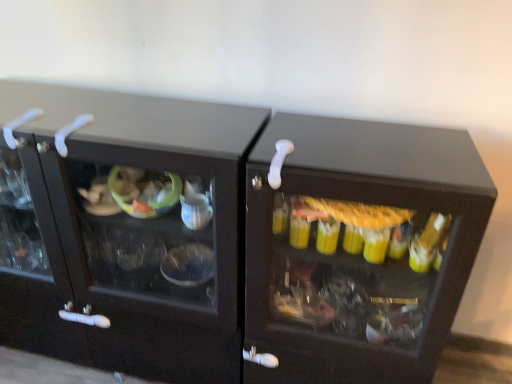
What is the approximate height of white plastic door handle at upper left, the 2th door handle positioned from the right?

9.15 centimeters.

Describe the element at coordinates (279, 162) in the screenshot. This screenshot has height=384, width=512. I see `white plastic door handle at center, the 3th door handle when ordered from left to right` at that location.

At what (x,y) coordinates should I click in order to perform the action: click on white plastic door handle at center, arranged as the first door handle when viewed from the right. Please return your answer as a coordinate pair (x, y). Looking at the image, I should click on (279, 162).

Find the location of a particular element. Image resolution: width=512 pixels, height=384 pixels. white plastic door handle at upper left, placed as the second door handle when sorted from left to right is located at coordinates (70, 132).

Could you measure the distance between white plastic door handle at center, the 3th door handle when ordered from left to right, and white plastic door handle at upper left, placed as the second door handle when sorted from left to right?

They are 59.71 centimeters apart.

Could white plastic door handle at upper left, the 2th door handle positioned from the right, be considered to be inside white plastic door handle at center, the 3th door handle when ordered from left to right?

No.

Considering the relative positions of white plastic door handle at center, the 3th door handle when ordered from left to right, and white plastic door handle at upper left, the 2th door handle positioned from the right, in the image provided, is white plastic door handle at center, the 3th door handle when ordered from left to right, in front of white plastic door handle at upper left, the 2th door handle positioned from the right,?

Yes, white plastic door handle at center, the 3th door handle when ordered from left to right, is closer to the viewer.

From the image's perspective, is white plastic door handle at center, arranged as the first door handle when viewed from the right, over white plastic door handle at upper left, the 2th door handle positioned from the right?

No, from the image's perspective, white plastic door handle at center, arranged as the first door handle when viewed from the right, is not over white plastic door handle at upper left, the 2th door handle positioned from the right.

Which object is thinner, white plastic door handle at upper left, placed as the 3th door handle when sorted from right to left, or white plastic door handle at upper left, the 2th door handle positioned from the right?

Thinner between the two is white plastic door handle at upper left, the 2th door handle positioned from the right.

Which is more to the left, white plastic door handle at upper left, acting as the 1th door handle starting from the left, or white plastic door handle at upper left, placed as the second door handle when sorted from left to right?

white plastic door handle at upper left, acting as the 1th door handle starting from the left.

Considering the points (21, 141) and (61, 148), which point is in front, point (21, 141) or point (61, 148)?

The point (61, 148) is closer to the camera.

Are white plastic door handle at upper left, placed as the 3th door handle when sorted from right to left, and white plastic door handle at upper left, the 2th door handle positioned from the right, making contact?

No, white plastic door handle at upper left, placed as the 3th door handle when sorted from right to left, is not with white plastic door handle at upper left, the 2th door handle positioned from the right.

Is white plastic door handle at upper left, acting as the 1th door handle starting from the left, positioned before white plastic door handle at center, the 3th door handle when ordered from left to right?

No, white plastic door handle at upper left, acting as the 1th door handle starting from the left, is further to the viewer.

From a real-world perspective, is white plastic door handle at upper left, placed as the 3th door handle when sorted from right to left, on white plastic door handle at center, arranged as the first door handle when viewed from the right?

Yes, from a real-world perspective, white plastic door handle at upper left, placed as the 3th door handle when sorted from right to left, is on top of white plastic door handle at center, arranged as the first door handle when viewed from the right.

Can you confirm if white plastic door handle at upper left, placed as the 3th door handle when sorted from right to left, is wider than white plastic door handle at center, arranged as the first door handle when viewed from the right?

In fact, white plastic door handle at upper left, placed as the 3th door handle when sorted from right to left, might be narrower than white plastic door handle at center, arranged as the first door handle when viewed from the right.

Is white plastic door handle at upper left, placed as the 3th door handle when sorted from right to left, positioned beyond the bounds of white plastic door handle at center, the 3th door handle when ordered from left to right?

Yes.

Who is shorter, white plastic door handle at center, the 3th door handle when ordered from left to right, or white plastic door handle at upper left, acting as the 1th door handle starting from the left?

white plastic door handle at center, the 3th door handle when ordered from left to right.

Consider the image. Which object is positioned more to the right, white plastic door handle at center, the 3th door handle when ordered from left to right, or white plastic door handle at upper left, acting as the 1th door handle starting from the left?

Positioned to the right is white plastic door handle at center, the 3th door handle when ordered from left to right.

Is white plastic door handle at center, arranged as the first door handle when viewed from the right, positioned with its back to white plastic door handle at upper left, acting as the 1th door handle starting from the left?

white plastic door handle at center, arranged as the first door handle when viewed from the right, is not turned away from white plastic door handle at upper left, acting as the 1th door handle starting from the left.

Which is farther, (286, 149) or (15, 145)?

The point (15, 145) is farther from the camera.

From a real-world perspective, does white plastic door handle at upper left, the 2th door handle positioned from the right, sit lower than white plastic door handle at center, the 3th door handle when ordered from left to right?

No.

Are white plastic door handle at upper left, placed as the second door handle when sorted from left to right, and white plastic door handle at center, the 3th door handle when ordered from left to right, far apart?

No, white plastic door handle at upper left, placed as the second door handle when sorted from left to right, is not far from white plastic door handle at center, the 3th door handle when ordered from left to right.

Does point (92, 119) come in front of point (293, 149)?

No, it is behind (293, 149).

Is white plastic door handle at center, the 3th door handle when ordered from left to right, located within white plastic door handle at upper left, placed as the second door handle when sorted from left to right?

No, white plastic door handle at center, the 3th door handle when ordered from left to right, is located outside of white plastic door handle at upper left, placed as the second door handle when sorted from left to right.

Could you tell me if white plastic door handle at upper left, placed as the second door handle when sorted from left to right, is turned towards white plastic door handle at upper left, placed as the 3th door handle when sorted from right to left?

No, white plastic door handle at upper left, placed as the second door handle when sorted from left to right, is not turned towards white plastic door handle at upper left, placed as the 3th door handle when sorted from right to left.

Which point is more forward, (81, 126) or (15, 124)?

The point (81, 126) is closer to the camera.

Locate an element on the screen. door handle that is the 1st one when counting downward from the white plastic door handle at upper left, placed as the 3th door handle when sorted from right to left (from the image's perspective) is located at coordinates (70, 132).

Which is in front, white plastic door handle at upper left, the 2th door handle positioned from the right, or white plastic door handle at upper left, placed as the 3th door handle when sorted from right to left?

white plastic door handle at upper left, the 2th door handle positioned from the right, is closer to the camera.

I want to click on door handle on the right of white plastic door handle at upper left, placed as the second door handle when sorted from left to right, so click(x=279, y=162).

From a real-world perspective, starting from the white plastic door handle at upper left, placed as the 3th door handle when sorted from right to left, which door handle is the 1st one below it? Please provide its 2D coordinates.

[(70, 132)]

Based on their spatial positions, is white plastic door handle at upper left, the 2th door handle positioned from the right, or white plastic door handle at center, the 3th door handle when ordered from left to right, closer to white plastic door handle at upper left, acting as the 1th door handle starting from the left?

white plastic door handle at upper left, the 2th door handle positioned from the right, is positioned closer to the anchor white plastic door handle at upper left, acting as the 1th door handle starting from the left.

Based on their spatial positions, is white plastic door handle at center, arranged as the first door handle when viewed from the right, or white plastic door handle at upper left, acting as the 1th door handle starting from the left, further from white plastic door handle at upper left, the 2th door handle positioned from the right?

The object further to white plastic door handle at upper left, the 2th door handle positioned from the right, is white plastic door handle at center, arranged as the first door handle when viewed from the right.

From the picture: Based on their spatial positions, is white plastic door handle at center, the 3th door handle when ordered from left to right, or white plastic door handle at upper left, the 2th door handle positioned from the right, closer to white plastic door handle at upper left, acting as the 1th door handle starting from the left?

white plastic door handle at upper left, the 2th door handle positioned from the right.

Looking at the image, which one is located closer to white plastic door handle at center, the 3th door handle when ordered from left to right, white plastic door handle at upper left, the 2th door handle positioned from the right, or white plastic door handle at upper left, acting as the 1th door handle starting from the left?

white plastic door handle at upper left, the 2th door handle positioned from the right, is closer to white plastic door handle at center, the 3th door handle when ordered from left to right.

Considering their positions, is white plastic door handle at upper left, placed as the 3th door handle when sorted from right to left, positioned closer to white plastic door handle at center, arranged as the first door handle when viewed from the right, than white plastic door handle at upper left, placed as the second door handle when sorted from left to right?

Among the two, white plastic door handle at upper left, placed as the second door handle when sorted from left to right, is located nearer to white plastic door handle at center, arranged as the first door handle when viewed from the right.

Based on their spatial positions, is white plastic door handle at upper left, acting as the 1th door handle starting from the left, or white plastic door handle at center, the 3th door handle when ordered from left to right, closer to white plastic door handle at upper left, the 2th door handle positioned from the right?

white plastic door handle at upper left, acting as the 1th door handle starting from the left, is positioned closer to the anchor white plastic door handle at upper left, the 2th door handle positioned from the right.

Where is `door handle between white plastic door handle at upper left, acting as the 1th door handle starting from the left, and white plastic door handle at center, the 3th door handle when ordered from left to right, from left to right`? The height and width of the screenshot is (384, 512). door handle between white plastic door handle at upper left, acting as the 1th door handle starting from the left, and white plastic door handle at center, the 3th door handle when ordered from left to right, from left to right is located at coordinates (70, 132).